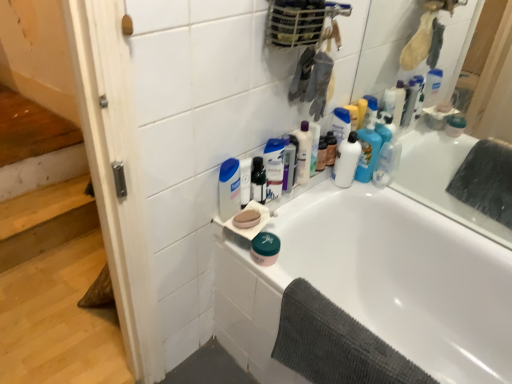
Question: Should I look upward or downward to see dark gray textured towel at lower right?

Choices:
 (A) up
 (B) down

Answer: (B)

Question: Does clear plastic bottle at upper center, the second cleaning product when ordered from front to back, have a greater height compared to pink matte soap at upper center?

Choices:
 (A) no
 (B) yes

Answer: (B)

Question: Would you say pink matte soap at upper center is part of clear plastic bottle at upper center, which is the 2th cleaning product in right-to-left order,'s contents?

Choices:
 (A) yes
 (B) no

Answer: (B)

Question: Is there a large distance between clear plastic bottle at upper center, the second cleaning product when ordered from front to back, and pink matte soap at upper center?

Choices:
 (A) no
 (B) yes

Answer: (A)

Question: From a real-world perspective, is clear plastic bottle at upper center, which is the 2th cleaning product in right-to-left order, on top of pink matte soap at upper center?

Choices:
 (A) yes
 (B) no

Answer: (A)

Question: Are clear plastic bottle at upper center, which is the 2th cleaning product in right-to-left order, and pink matte soap at upper center beside each other?

Choices:
 (A) no
 (B) yes

Answer: (A)

Question: Does clear plastic bottle at upper center, the second cleaning product when ordered from front to back, have a smaller size compared to pink matte soap at upper center?

Choices:
 (A) no
 (B) yes

Answer: (A)

Question: Is wooden stairs at left facing towards clear plastic bottle at upper center, acting as the second cleaning product starting from the back?

Choices:
 (A) no
 (B) yes

Answer: (A)

Question: Is wooden stairs at left smaller than clear plastic bottle at upper center, acting as the second cleaning product starting from the back?

Choices:
 (A) yes
 (B) no

Answer: (B)

Question: Is clear plastic bottle at upper center, the second cleaning product when ordered from front to back, a part of wooden stairs at left?

Choices:
 (A) no
 (B) yes

Answer: (A)

Question: Does wooden stairs at left have a greater width compared to clear plastic bottle at upper center, the second cleaning product when ordered from front to back?

Choices:
 (A) yes
 (B) no

Answer: (A)

Question: Is wooden stairs at left oriented away from clear plastic bottle at upper center, the 2th cleaning product when ordered from left to right?

Choices:
 (A) no
 (B) yes

Answer: (A)

Question: Is wooden stairs at left at the left side of clear plastic bottle at upper center, the second cleaning product when ordered from front to back?

Choices:
 (A) no
 (B) yes

Answer: (B)

Question: Is clear plastic bottle at upper center, the second cleaning product when ordered from front to back, next to white matte lotion at upper right, marked as the third cleaning product in a right-to-left arrangement?

Choices:
 (A) no
 (B) yes

Answer: (A)